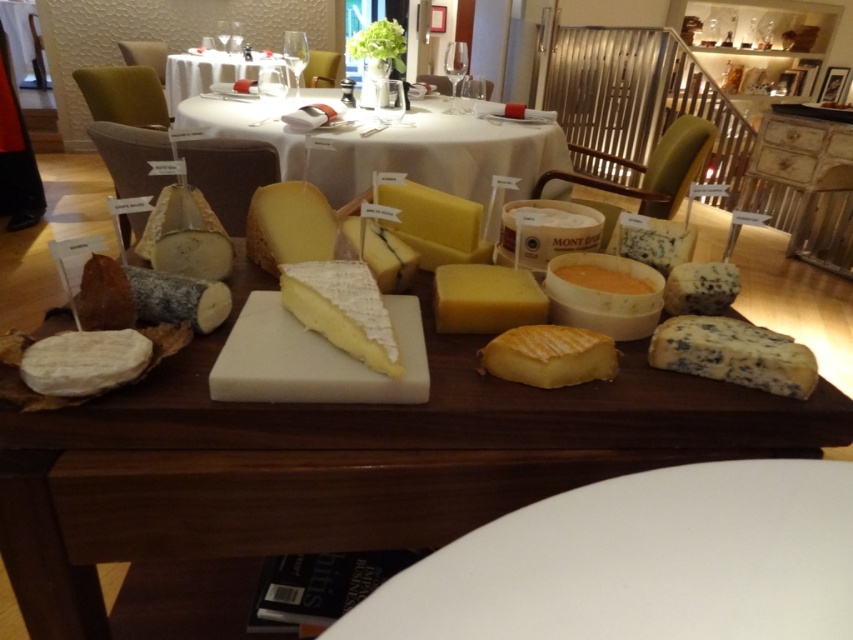
Question: Can you confirm if yellow creamy cheese at center is bigger than white porcelain table at upper center?

Choices:
 (A) no
 (B) yes

Answer: (A)

Question: Is white glossy plate at lower center to the right of yellow semi-hard cheese at center from the viewer's perspective?

Choices:
 (A) no
 (B) yes

Answer: (B)

Question: Can you confirm if wooden cheese board at center is bigger than white creamy cheese at center?

Choices:
 (A) yes
 (B) no

Answer: (A)

Question: Which point appears closest to the camera in this image?

Choices:
 (A) (581, 381)
 (B) (486, 188)
 (C) (422, 230)

Answer: (A)

Question: Based on their relative distances, which object is nearer to the white glossy plate at lower center?

Choices:
 (A) white marble cheese board at center
 (B) yellow hard cheese at center

Answer: (B)

Question: Which of the following is the farthest from the observer?

Choices:
 (A) yellow creamy cheese at center
 (B) white marble cheese board at center

Answer: (B)